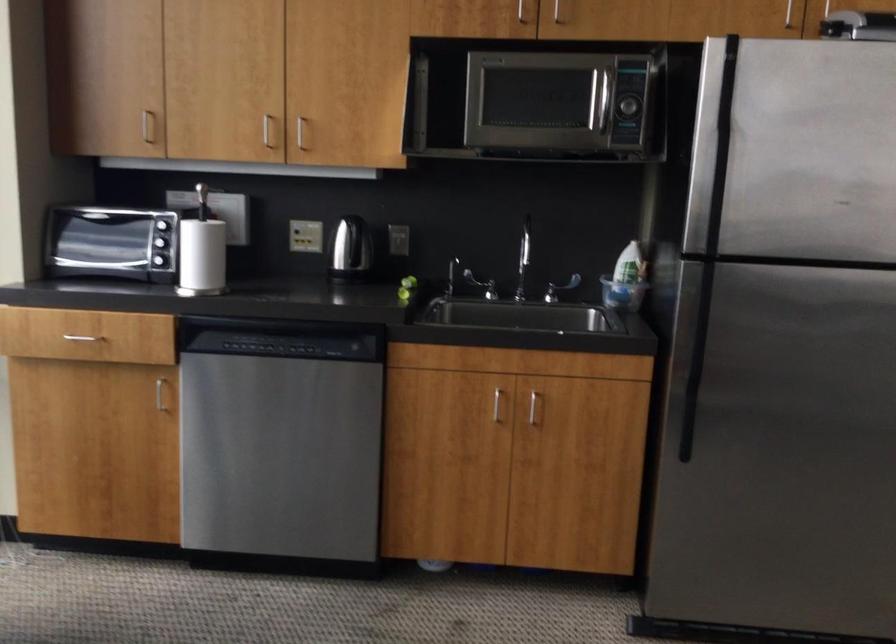
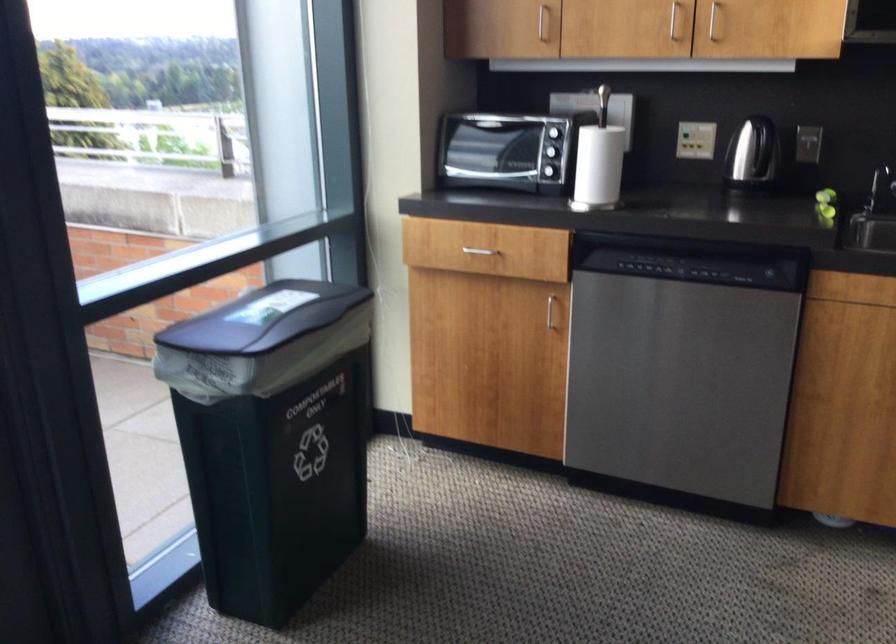
The point at (156, 120) is marked in the first image. Where is the corresponding point in the second image?

(543, 23)